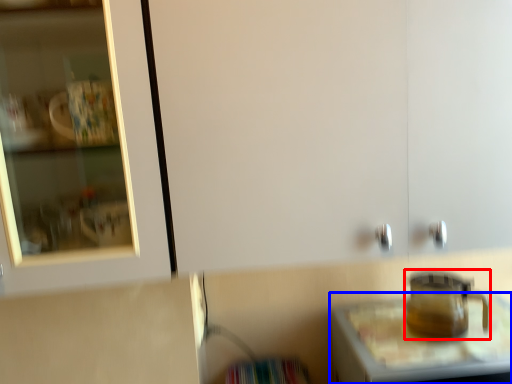
Question: Among these objects, which one is nearest to the camera, appliance (highlighted by a red box) or table (highlighted by a blue box)?

Choices:
 (A) appliance
 (B) table

Answer: (B)